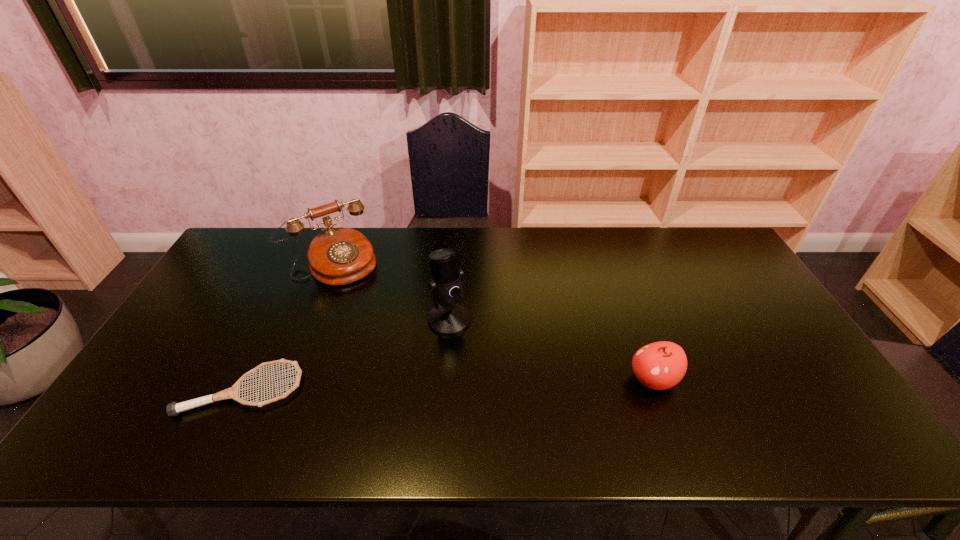
This screenshot has height=540, width=960. What are the coordinates of `free spot on the desktop that is between the shortest object and the rightmost object and is positioned on the dial of the farthest object` in the screenshot? It's located at (417, 386).

This screenshot has width=960, height=540. I want to click on free space on the desktop that is between the shortest object and the apple and is positioned on the stand of the tallest object, so click(480, 384).